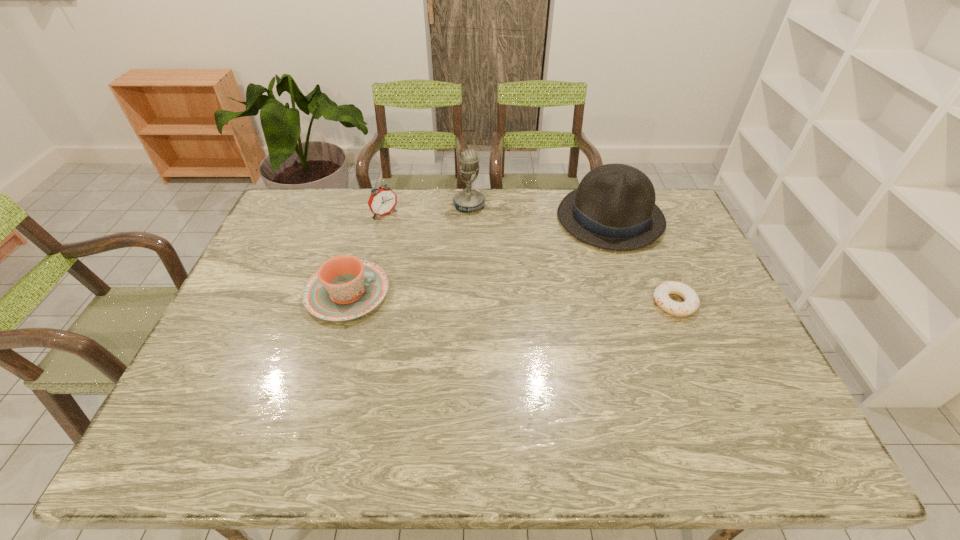
Where is `free spot located on the clock face of the alarm clock`? free spot located on the clock face of the alarm clock is located at coordinates (403, 232).

Locate an element on the screen. vacant area located on the front-facing side of the bowler hat is located at coordinates (553, 261).

Identify the location of vacant space located 0.260m on the front-facing side of the bowler hat. (525, 281).

Image resolution: width=960 pixels, height=540 pixels. Identify the location of vacant region located 0.070m on the front-facing side of the bowler hat. (564, 252).

I want to click on vacant point located on the front-facing side of the tallest object, so click(505, 265).

This screenshot has height=540, width=960. I want to click on free region located on the front-facing side of the tallest object, so click(509, 272).

This screenshot has height=540, width=960. Find the location of `free space located on the front-facing side of the tallest object`. free space located on the front-facing side of the tallest object is located at coordinates (518, 289).

I want to click on alarm clock located in the far edge section of the desktop, so click(x=382, y=201).

Identify the location of bowler hat that is at the far edge. The image size is (960, 540). (614, 208).

The height and width of the screenshot is (540, 960). Find the location of `microphone situated at the far edge`. microphone situated at the far edge is located at coordinates (467, 200).